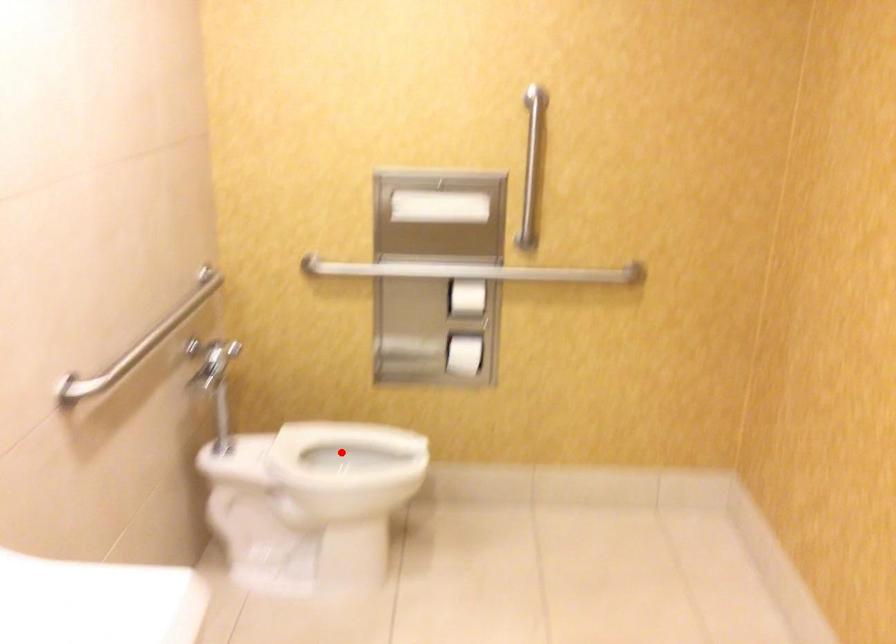
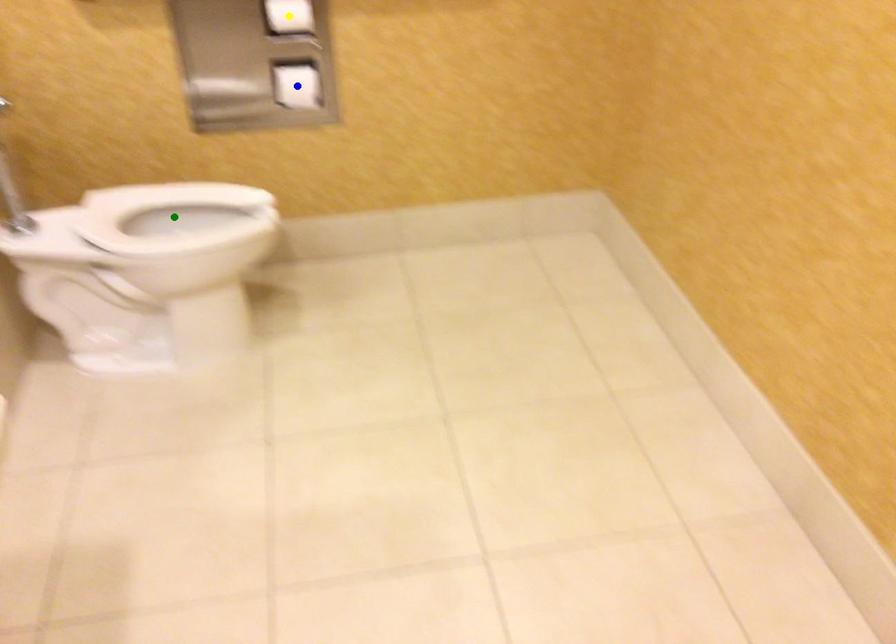
Question: I am providing you with two images of the same scene from different viewpoints. A red point is marked on the first image. You are given multiple points on the second image. Which spot in image 2 lines up with the point in image 1?

Choices:
 (A) blue point
 (B) green point
 (C) yellow point

Answer: (B)